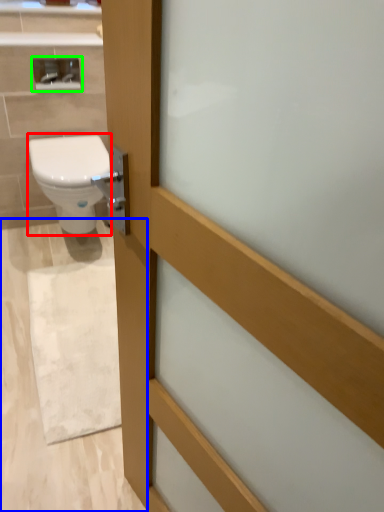
Question: Considering the real-world distances, which object is farthest from bidet (highlighted by a red box)? plain (highlighted by a blue box) or medicine cabinet (highlighted by a green box)?

Choices:
 (A) plain
 (B) medicine cabinet

Answer: (A)